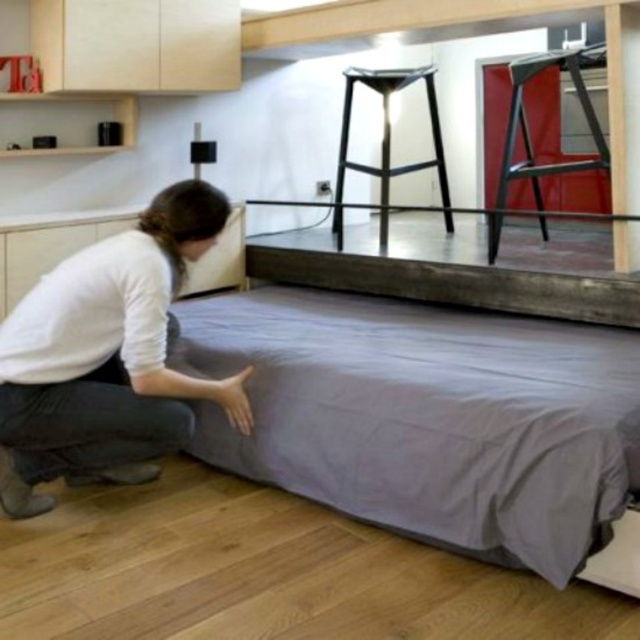
Question: Does metallic black stool at upper center appear over metallic stool at upper center?

Choices:
 (A) yes
 (B) no

Answer: (B)

Question: Which is farther from the metallic stool at upper center?

Choices:
 (A) metallic black stool at upper center
 (B) gray fabric mattress at lower center
 (C) white cotton shirt at lower left

Answer: (C)

Question: Which point is closer to the camera taking this photo?

Choices:
 (A) (385, 84)
 (B) (499, 186)
 (C) (460, 444)
 (D) (109, 419)

Answer: (C)

Question: Can you confirm if white cotton shirt at lower left is thinner than metallic black stool at upper center?

Choices:
 (A) yes
 (B) no

Answer: (A)

Question: Is the position of white cotton shirt at lower left less distant than that of metallic stool at upper center?

Choices:
 (A) yes
 (B) no

Answer: (A)

Question: Which is nearer to the white cotton shirt at lower left?

Choices:
 (A) metallic black stool at upper center
 (B) gray fabric mattress at lower center

Answer: (B)